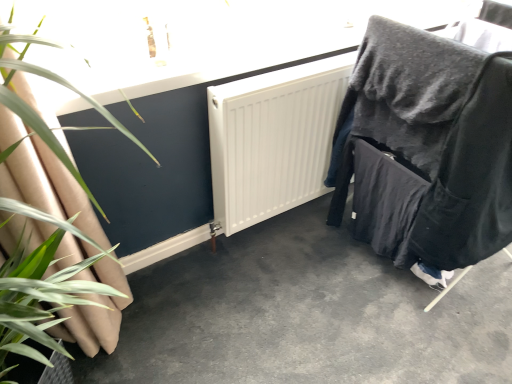
Locate an element on the screen. Image resolution: width=512 pixels, height=384 pixels. vacant area that is situated to the right of green leafy plant at left is located at coordinates (170, 327).